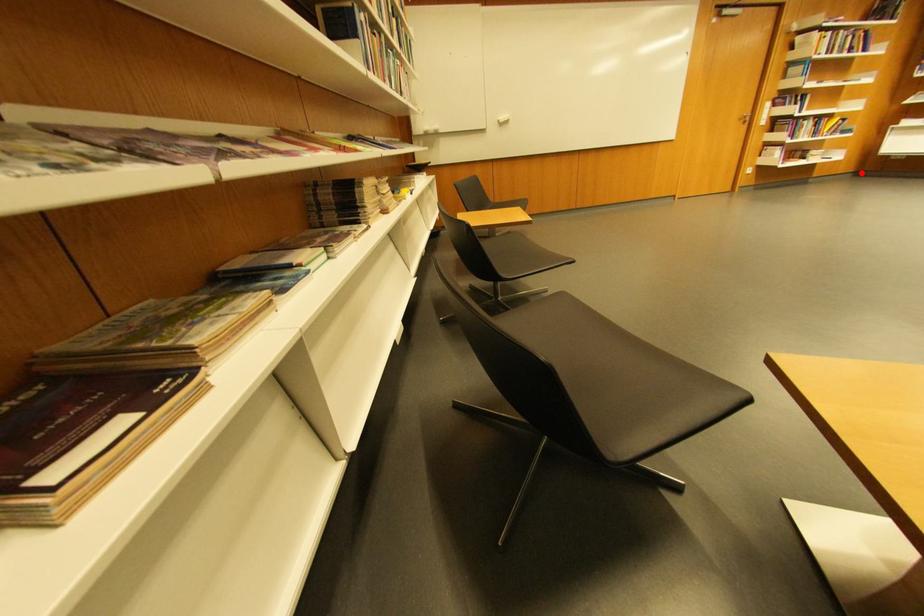
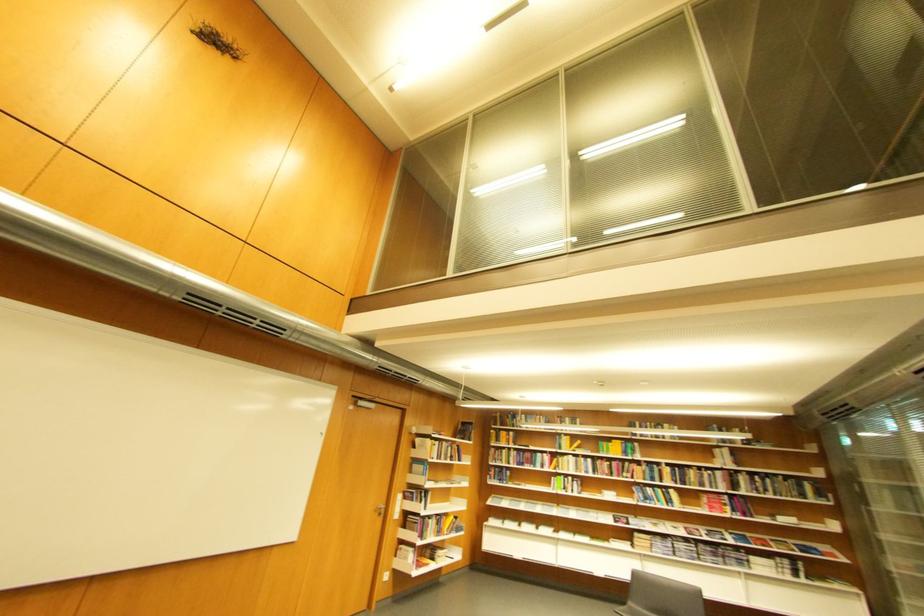
Question: A red point is marked in image1. In image2, is the corresponding 3D point closer to the camera or farther? Reply with the corresponding letter.

Choices:
 (A) The corresponding 3D point is closer.
 (B) The corresponding 3D point is farther.

Answer: (A)